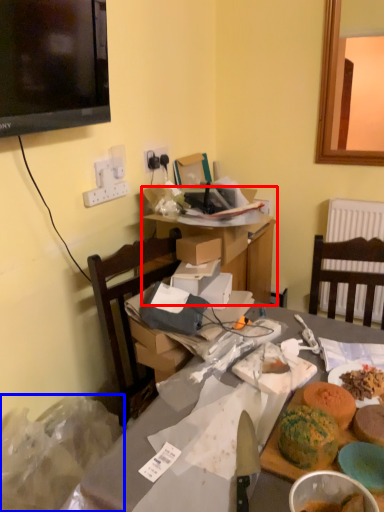
Question: Which of the following is the closest to the observer, table (highlighted by a red box) or waste (highlighted by a blue box)?

Choices:
 (A) table
 (B) waste

Answer: (B)